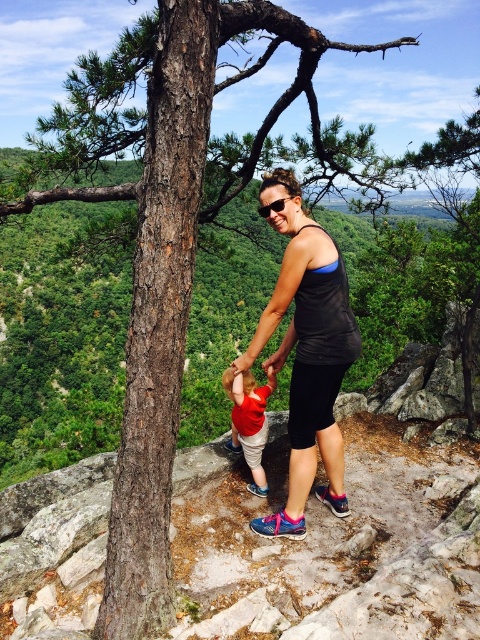
Does black matte tank top at center lie in front of red cotton shirt at center?

Yes.

Does black matte tank top at center have a lesser width compared to red cotton shirt at center?

No, black matte tank top at center is not thinner than red cotton shirt at center.

Is point (336, 442) positioned after point (252, 467)?

No, (336, 442) is in front of (252, 467).

This screenshot has width=480, height=640. What are the coordinates of `black matte tank top at center` in the screenshot? It's located at (307, 353).